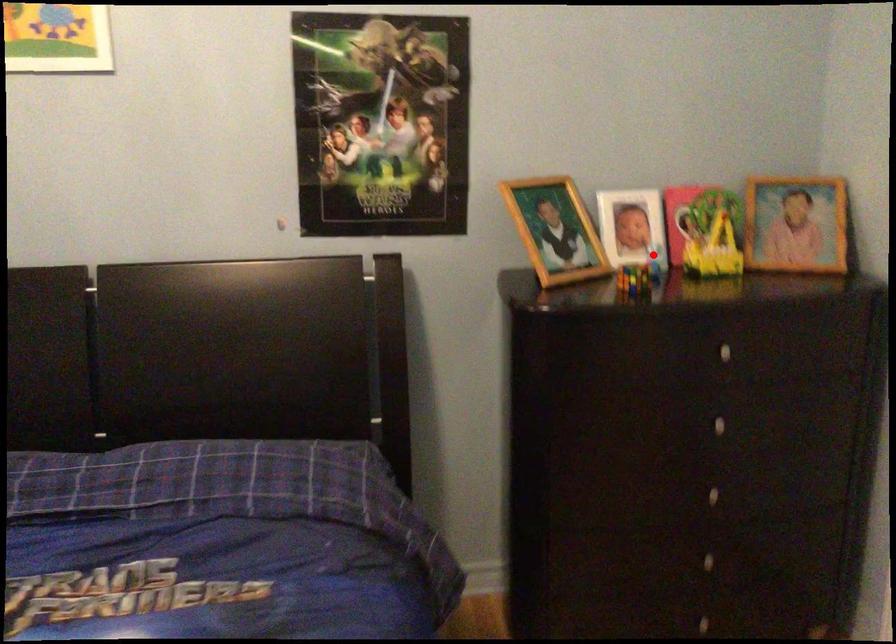
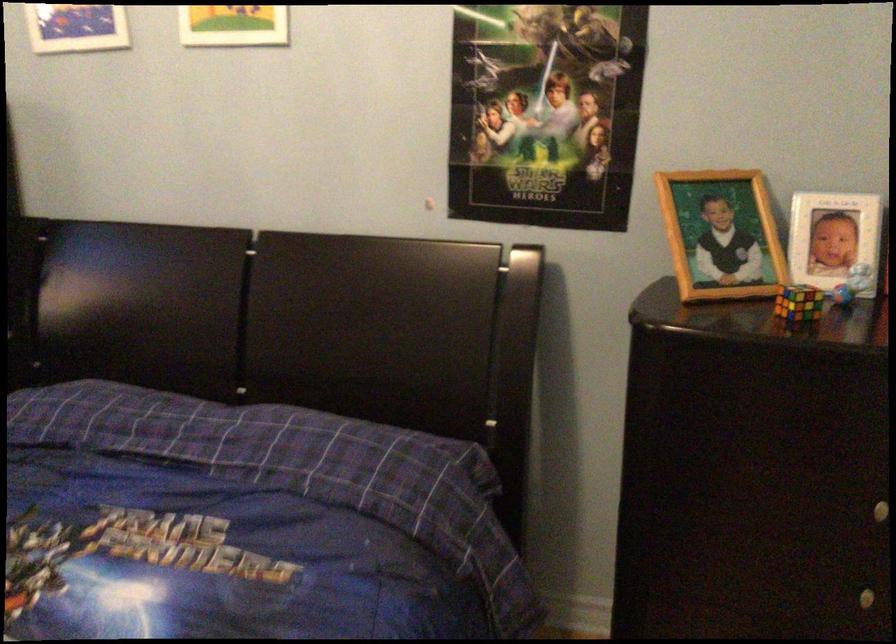
Question: I am providing you with two images of the same scene from different viewpoints. Image1 has a red point marked. In image2, the corresponding 3D location appears at what relative position? Reply with the corresponding letter.

Choices:
 (A) Closer
 (B) Farther

Answer: (A)